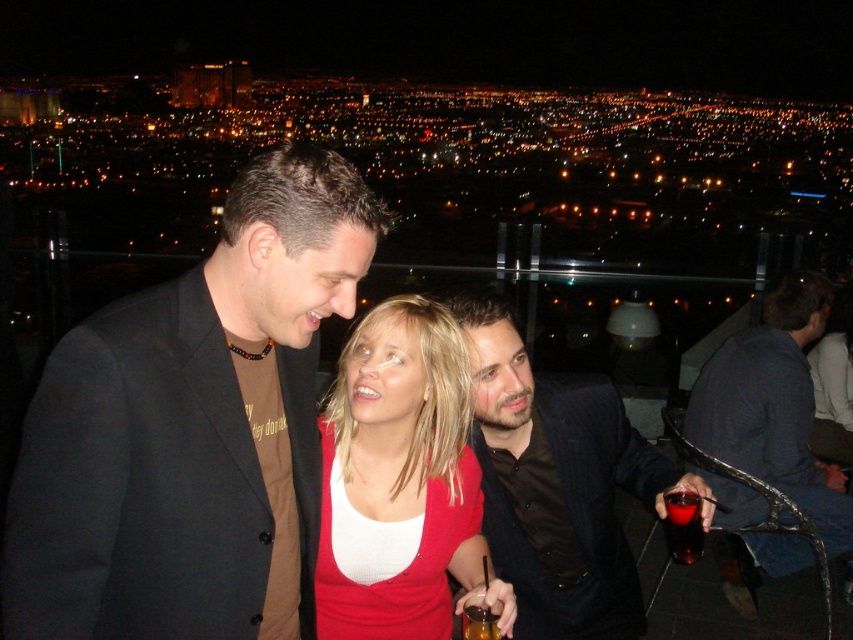
Does matte black jacket at center appear under translucent amber liquid at lower center?

No, matte black jacket at center is not below translucent amber liquid at lower center.

Between matte black jacket at center and translucent amber liquid at lower center, which one is positioned higher?

matte black jacket at center is above.

Find the location of a particular element. The image size is (853, 640). matte black jacket at center is located at coordinates (193, 428).

Where is `matte black jacket at center`? matte black jacket at center is located at coordinates 193,428.

Which of these two, shiny black suit at center or translucent plastic cup at lower right, stands taller?

With more height is shiny black suit at center.

Between point (598, 568) and point (698, 529), which one is positioned in front?

Point (698, 529)

At what (x,y) coordinates should I click in order to perform the action: click on shiny black suit at center. Please return your answer as a coordinate pair (x, y). Looking at the image, I should click on (556, 483).

Between point (54, 554) and point (527, 444), which one is positioned behind?

Point (527, 444)

Does matte black jacket at center have a smaller size compared to shiny black suit at center?

No, matte black jacket at center is not smaller than shiny black suit at center.

Between point (329, 218) and point (631, 636), which one is positioned in front?

Positioned in front is point (329, 218).

This screenshot has width=853, height=640. I want to click on matte black jacket at center, so click(193, 428).